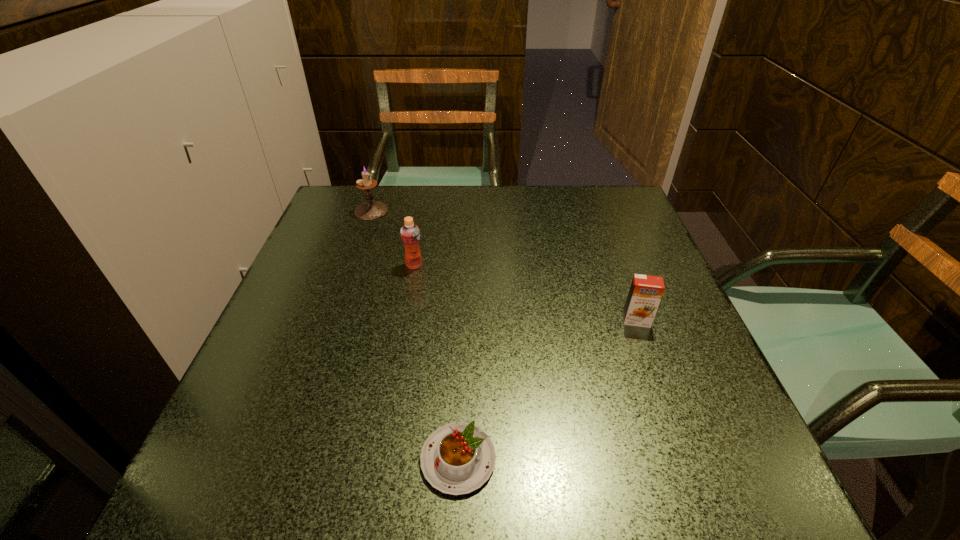
What are the coordinates of `vacant space in between the farther orange juice and the nearest object` in the screenshot? It's located at (436, 362).

This screenshot has width=960, height=540. I want to click on vacant point located between the nearest object and the taller orange juice, so click(x=436, y=362).

Identify the location of empty space that is in between the second farthest object and the nearer orange juice. (525, 293).

I want to click on free spot between the second object from right to left and the candle holder, so click(x=415, y=335).

Locate which object ranks in proximity to the shortest object. Please provide its 2D coordinates. Your answer should be formatted as a tuple, i.e. [(x, y)], where the tuple contains the x and y coordinates of a point satisfying the conditions above.

[(646, 291)]

Where is `object that is the second closest one to the second farthest object`? object that is the second closest one to the second farthest object is located at coordinates (458, 458).

You are a GUI agent. You are given a task and a screenshot of the screen. Output one action in this format:
    pyautogui.click(x=<x>, y=<y>)
    Task: Click on the free location that satisfies the following two spatial constraints: 1. on the front side of the left orange juice; 2. on the right side of the second object from right to left
    This screenshot has width=960, height=540.
    Given the screenshot: What is the action you would take?
    pyautogui.click(x=380, y=459)

You are a GUI agent. You are given a task and a screenshot of the screen. Output one action in this format:
    pyautogui.click(x=<x>, y=<y>)
    Task: Click on the free spot that satisfies the following two spatial constraints: 1. on the front side of the taller orange juice; 2. on the right side of the nearer orange juice
    
    Given the screenshot: What is the action you would take?
    pyautogui.click(x=404, y=320)